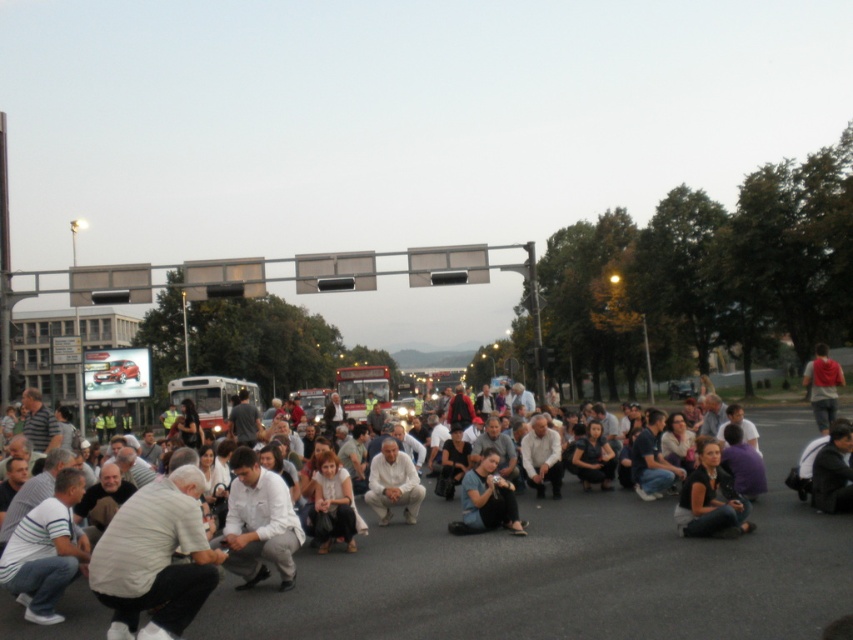
Who is positioned more to the left, white striped shirt at lower left or white matte shirt at center?

Positioned to the left is white striped shirt at lower left.

Where is `white striped shirt at lower left`? The width and height of the screenshot is (853, 640). white striped shirt at lower left is located at coordinates (45, 552).

Identify the location of white striped shirt at lower left. (45, 552).

This screenshot has width=853, height=640. Describe the element at coordinates (711, 499) in the screenshot. I see `dark blue jeans at lower right` at that location.

Describe the element at coordinates (711, 499) in the screenshot. I see `dark blue jeans at lower right` at that location.

You are a GUI agent. You are given a task and a screenshot of the screen. Output one action in this format:
    pyautogui.click(x=<x>, y=<y>)
    Task: Click on the dark blue jeans at lower right
    The width and height of the screenshot is (853, 640).
    Given the screenshot: What is the action you would take?
    pyautogui.click(x=711, y=499)

Between white cotton shirt at center and white cotton shirt at lower left, which one has less height?

With less height is white cotton shirt at center.

Is white cotton shirt at center below white cotton shirt at lower left?

Yes, white cotton shirt at center is below white cotton shirt at lower left.

Is point (637, 602) closer to viewer compared to point (120, 525)?

No.

This screenshot has height=640, width=853. I want to click on white cotton shirt at center, so click(x=541, y=577).